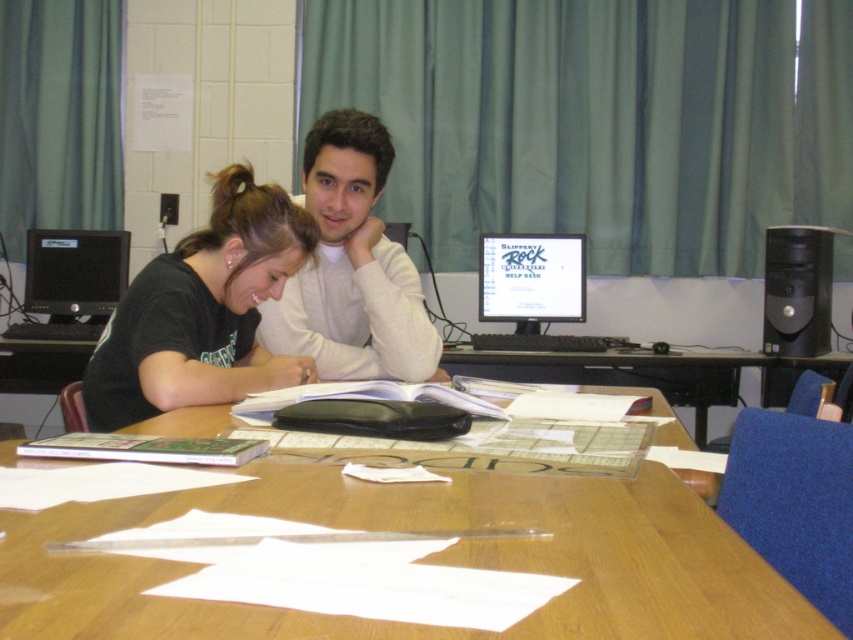
Between wooden table at center and white matte sweater at center, which one has more height?

Standing taller between the two is white matte sweater at center.

In the scene shown: Does wooden table at center have a greater width compared to white matte sweater at center?

Correct, the width of wooden table at center exceeds that of white matte sweater at center.

What do you see at coordinates (426, 560) in the screenshot? The image size is (853, 640). I see `wooden table at center` at bounding box center [426, 560].

At what (x,y) coordinates should I click in order to perform the action: click on wooden table at center. Please return your answer as a coordinate pair (x, y). The width and height of the screenshot is (853, 640). Looking at the image, I should click on (426, 560).

Which is below, matte black monitor at left or matte black monitor at center?

matte black monitor at left is lower down.

Is point (82, 230) closer to camera compared to point (558, 272)?

That is False.

Which is in front, point (109, 284) or point (524, 243)?

Point (524, 243) is more forward.

What are the coordinates of `matte black monitor at left` in the screenshot? It's located at pyautogui.click(x=71, y=282).

Which is below, black matte shirt at upper left or matte black monitor at center?

black matte shirt at upper left is lower down.

Is point (146, 348) farther from camera compared to point (485, 275)?

No, (146, 348) is in front of (485, 275).

Which is in front, point (119, 346) or point (521, 257)?

Point (119, 346) is more forward.

Where is `black matte shirt at upper left`? black matte shirt at upper left is located at coordinates (202, 310).